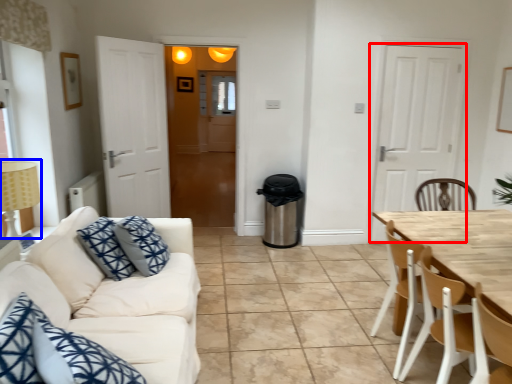
Question: Which point is closer to the camera, door (highlighted by a red box) or lamp (highlighted by a blue box)?

Choices:
 (A) door
 (B) lamp

Answer: (B)